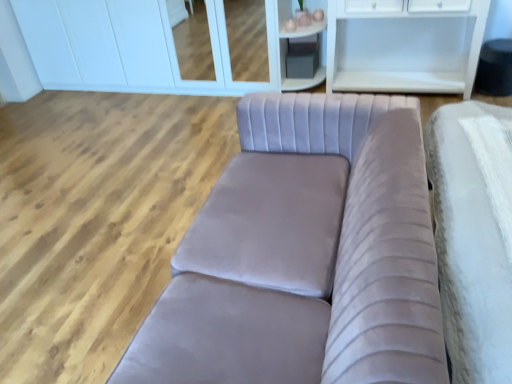
Question: In the image, is white glossy cabinet at upper center on the left side or the right side of matte gray cube at upper center?

Choices:
 (A) right
 (B) left

Answer: (B)

Question: Which is correct: white glossy cabinet at upper center is inside matte gray cube at upper center, or outside of it?

Choices:
 (A) outside
 (B) inside

Answer: (A)

Question: Based on their relative distances, which object is nearer to the velvet grey couch at center?

Choices:
 (A) white glossy cabinet at upper center
 (B) matte gray cube at upper center

Answer: (B)

Question: Estimate the real-world distances between objects in this image. Which object is farther from the velvet grey couch at center?

Choices:
 (A) matte gray cube at upper center
 (B) white glossy cabinet at upper center

Answer: (B)